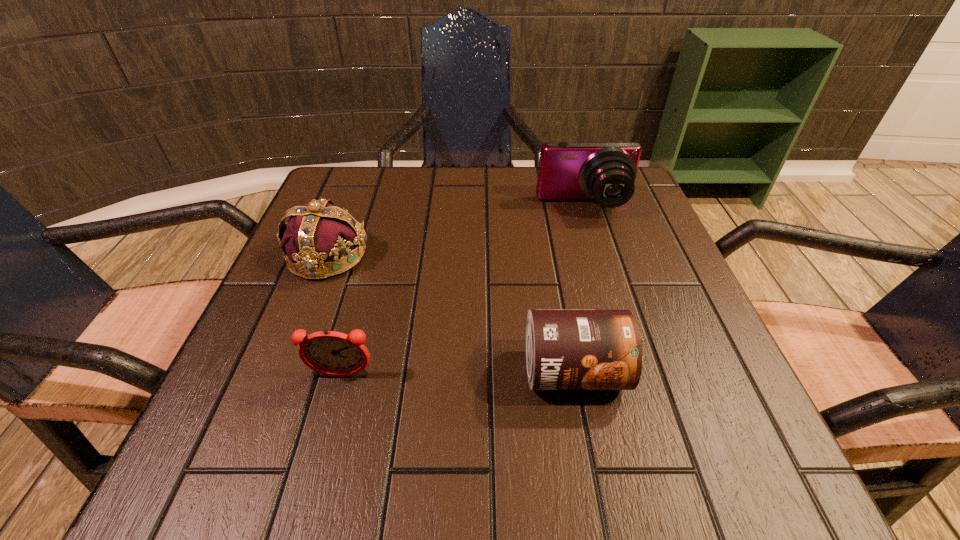
Locate an element on the screen. This screenshot has height=540, width=960. free spot between the can and the farthest object is located at coordinates (579, 289).

Where is `free spot between the can and the alarm clock`? free spot between the can and the alarm clock is located at coordinates (457, 374).

The width and height of the screenshot is (960, 540). Find the location of `free point between the alarm clock and the crown`. free point between the alarm clock and the crown is located at coordinates (335, 316).

The height and width of the screenshot is (540, 960). Identify the location of vacant area between the farthest object and the crown. (456, 232).

You are a GUI agent. You are given a task and a screenshot of the screen. Output one action in this format:
    pyautogui.click(x=<x>, y=<y>)
    Task: Click on the empty location between the can and the camera
    
    Given the screenshot: What is the action you would take?
    pyautogui.click(x=579, y=289)

Find the location of a particular element. The width and height of the screenshot is (960, 540). blank region between the can and the farthest object is located at coordinates (579, 289).

You are a GUI agent. You are given a task and a screenshot of the screen. Output one action in this format:
    pyautogui.click(x=<x>, y=<y>)
    Task: Click on the free spot between the can and the farthest object
    
    Given the screenshot: What is the action you would take?
    pyautogui.click(x=579, y=289)

Identify the location of free point between the can and the camera. This screenshot has height=540, width=960. (579, 289).

You are a GUI agent. You are given a task and a screenshot of the screen. Output one action in this format:
    pyautogui.click(x=<x>, y=<y>)
    Task: Click on the vacant area that lies between the can and the camera
    
    Given the screenshot: What is the action you would take?
    pyautogui.click(x=579, y=289)

Select which object is the second closest to the alarm clock. Please provide its 2D coordinates. Your answer should be formatted as a tuple, i.e. [(x, y)], where the tuple contains the x and y coordinates of a point satisfying the conditions above.

[(565, 349)]